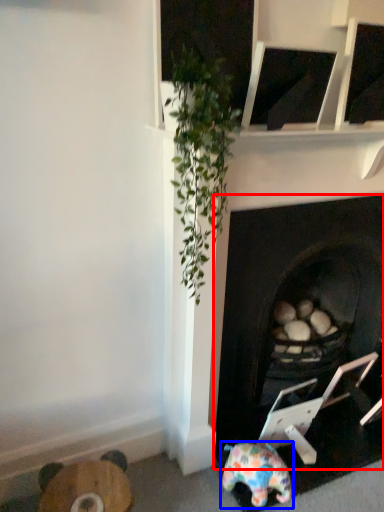
Question: Which object appears farthest to the camera in this image, fireplace (highlighted by a red box) or toy (highlighted by a blue box)?

Choices:
 (A) fireplace
 (B) toy

Answer: (B)